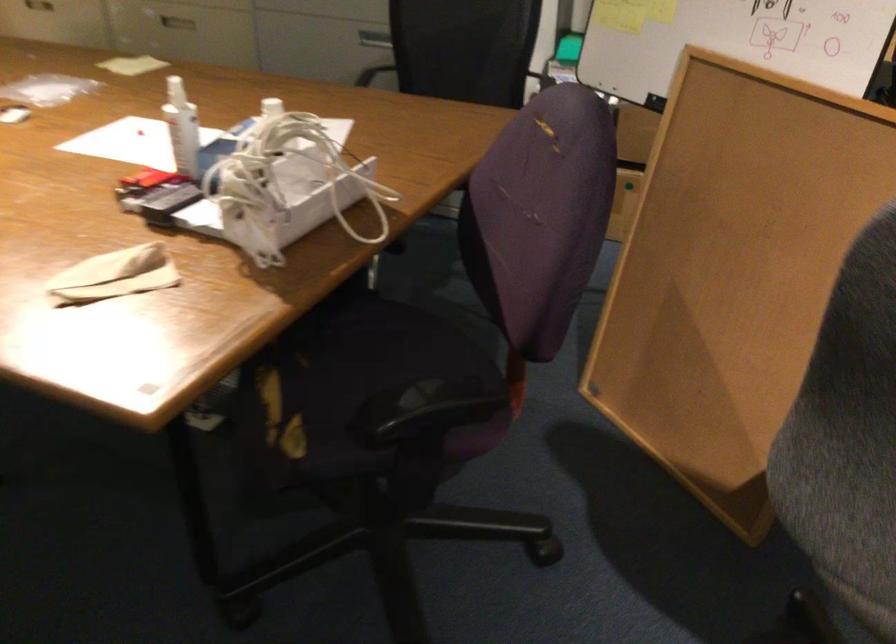
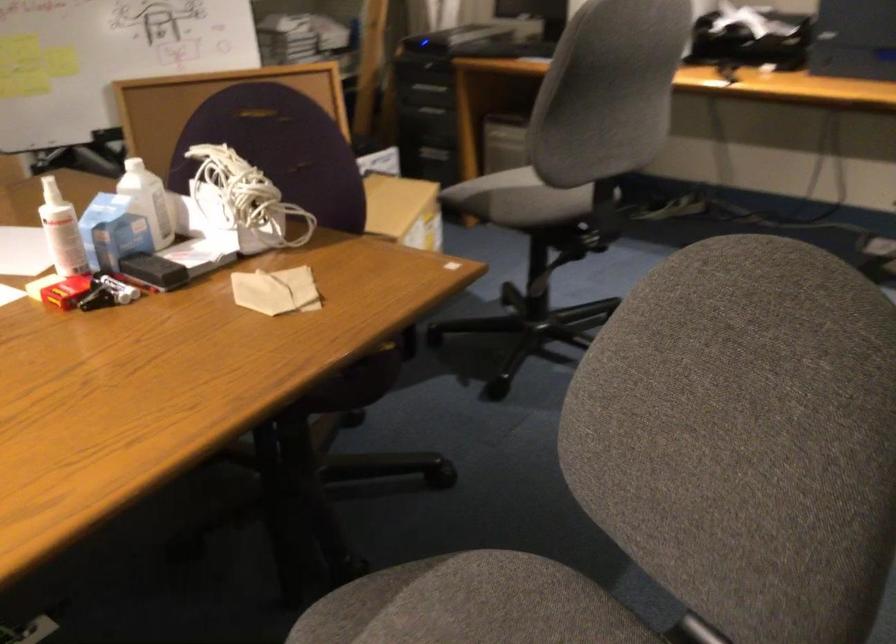
Where in the second image is the point corresponding to (211,149) from the first image?

(114, 225)